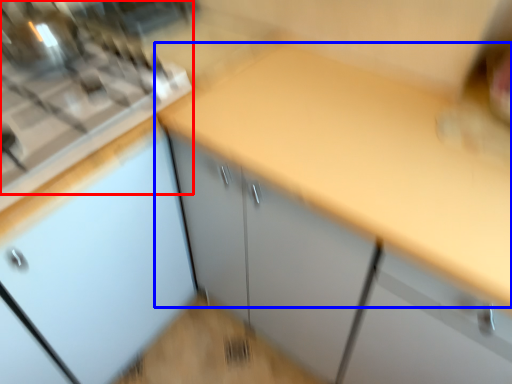
Question: Which object appears closest to the camera in this image, gas stove (highlighted by a red box) or countertop (highlighted by a blue box)?

Choices:
 (A) gas stove
 (B) countertop

Answer: (B)